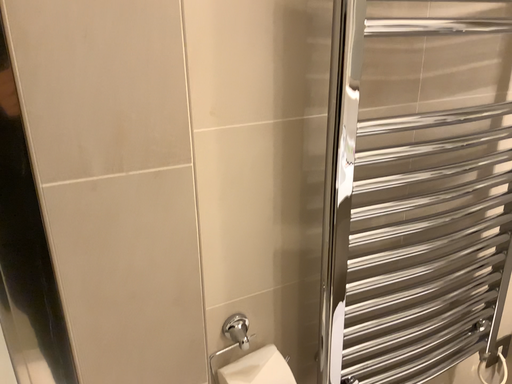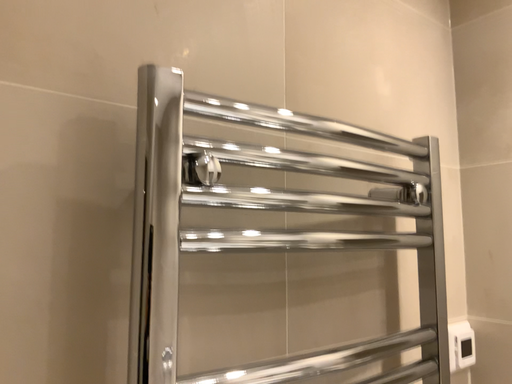
Question: How did the camera likely rotate when shooting the video?

Choices:
 (A) rotated right
 (B) rotated left

Answer: (A)